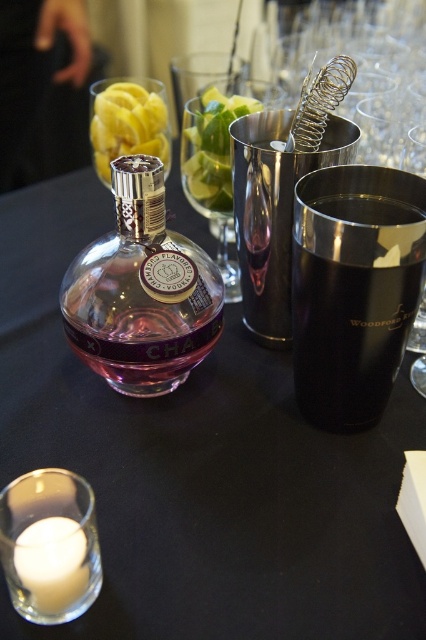
Question: Which object is positioned closest to the yellow matte lemon at upper left?

Choices:
 (A) black matte cup at right
 (B) pink glass bottle at center
 (C) white wax candle at lower left
 (D) green matte lemon at center

Answer: (D)

Question: Does pink glass bottle at center have a greater width compared to white wax candle at lower left?

Choices:
 (A) no
 (B) yes

Answer: (B)

Question: Which of the following is the closest to the observer?

Choices:
 (A) white wax candle at lower left
 (B) black matte cup at right
 (C) pink glass bottle at center
 (D) green matte lemon at center

Answer: (A)

Question: Among these objects, which one is farthest from the camera?

Choices:
 (A) white wax candle at lower left
 (B) green matte lemon at center

Answer: (B)

Question: Does black matte cup at right appear on the right side of pink glass bottle at center?

Choices:
 (A) no
 (B) yes

Answer: (B)

Question: Does black matte cup at right have a larger size compared to pink glass bottle at center?

Choices:
 (A) yes
 (B) no

Answer: (B)